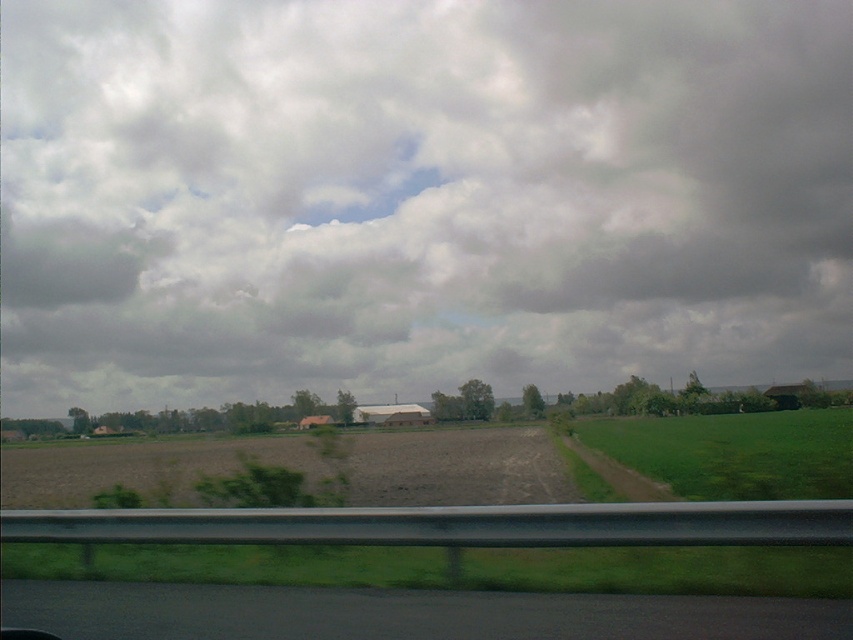
Question: Which is nearer to the green grassy field at right?

Choices:
 (A) cloudy sky at upper center
 (B) black asphalt road at lower left

Answer: (B)

Question: Does black asphalt road at lower left appear under green grassy field at right?

Choices:
 (A) no
 (B) yes

Answer: (A)

Question: Estimate the real-world distances between objects in this image. Which object is farther from the cloudy sky at upper center?

Choices:
 (A) black asphalt road at lower left
 (B) green grassy field at right

Answer: (A)

Question: Which of the following is the farthest from the observer?

Choices:
 (A) black asphalt road at lower left
 (B) green grassy field at right
 (C) cloudy sky at upper center

Answer: (C)

Question: Can you confirm if cloudy sky at upper center is positioned to the right of black asphalt road at lower left?

Choices:
 (A) no
 (B) yes

Answer: (A)

Question: Is cloudy sky at upper center wider than green grassy field at right?

Choices:
 (A) yes
 (B) no

Answer: (A)